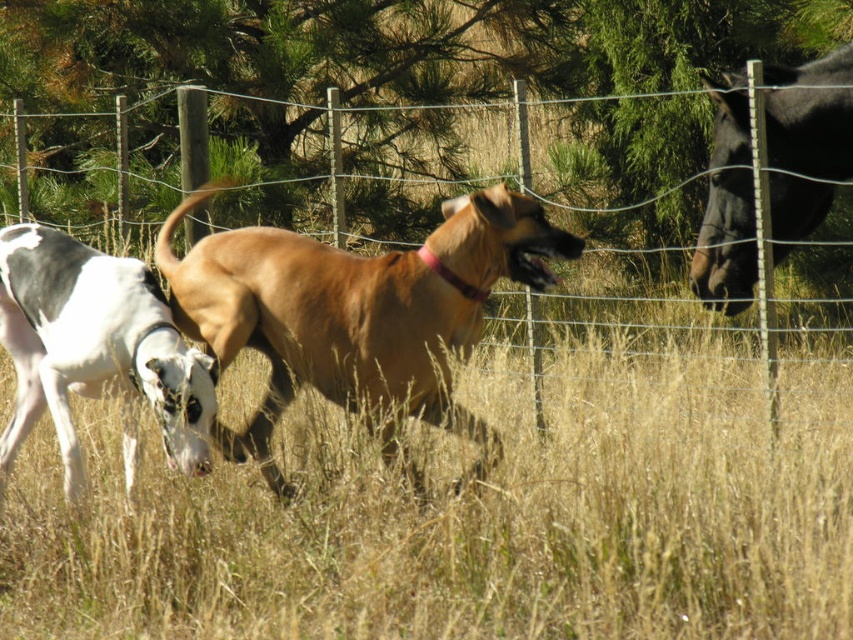
Can you confirm if sandy fur dog at center is positioned to the right of wire mesh fence at center?

Yes, sandy fur dog at center is to the right of wire mesh fence at center.

Does sandy fur dog at center have a smaller size compared to wire mesh fence at center?

No, sandy fur dog at center is not smaller than wire mesh fence at center.

Describe the element at coordinates (357, 310) in the screenshot. I see `sandy fur dog at center` at that location.

At what (x,y) coordinates should I click in order to perform the action: click on sandy fur dog at center. Please return your answer as a coordinate pair (x, y). Looking at the image, I should click on (357, 310).

Between white glossy dog at left and wire mesh fence at center, which one appears on the right side from the viewer's perspective?

wire mesh fence at center is more to the right.

Between white glossy dog at left and wire mesh fence at center, which one has less height?

With less height is wire mesh fence at center.

Is point (62, 410) closer to viewer compared to point (796, 176)?

Yes.

You are a GUI agent. You are given a task and a screenshot of the screen. Output one action in this format:
    pyautogui.click(x=<x>, y=<y>)
    Task: Click on the white glossy dog at left
    
    Given the screenshot: What is the action you would take?
    pyautogui.click(x=96, y=349)

Does dry grass at center appear under wire mesh fence at center?

Yes, dry grass at center is below wire mesh fence at center.

Which is below, dry grass at center or wire mesh fence at center?

dry grass at center is lower down.

Locate an element on the screen. This screenshot has height=640, width=853. dry grass at center is located at coordinates (471, 516).

You are a GUI agent. You are given a task and a screenshot of the screen. Output one action in this format:
    pyautogui.click(x=<x>, y=<y>)
    Task: Click on the dry grass at center
    Image resolution: width=853 pixels, height=640 pixels.
    Given the screenshot: What is the action you would take?
    pyautogui.click(x=471, y=516)